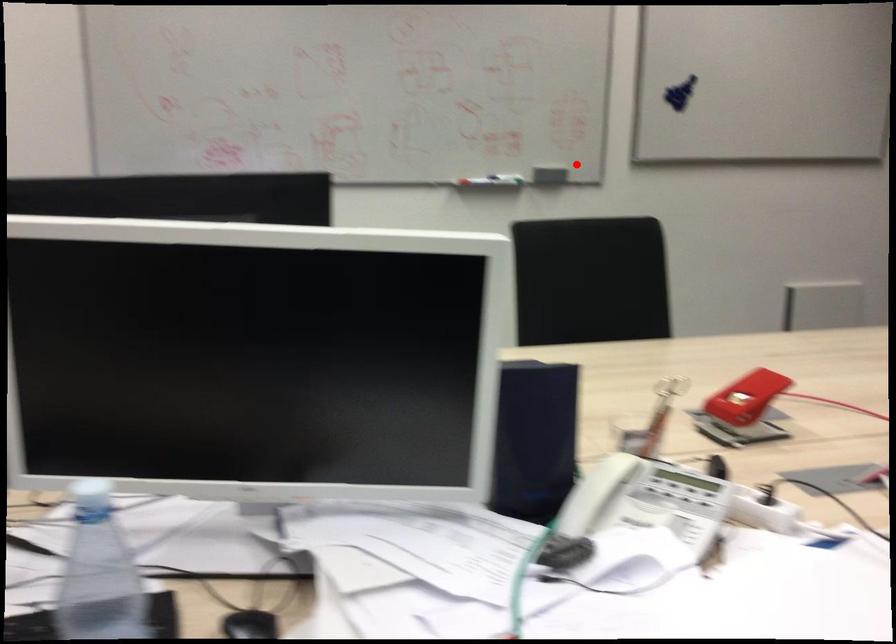
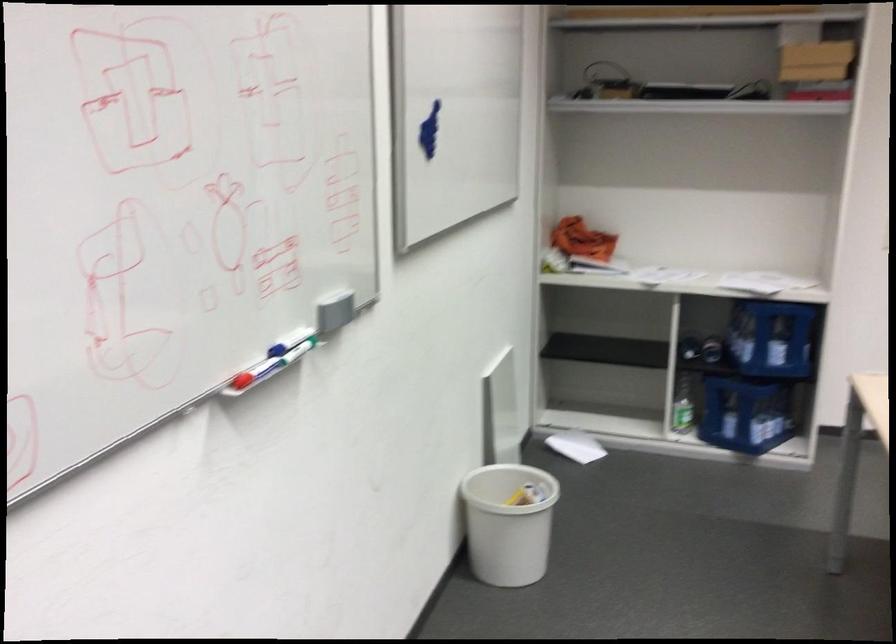
Question: I am providing you with two images of the same scene from different viewpoints. A red point is shown in image1. For the corresponding object point in image2, is it positioned nearer or farther from the camera?

Choices:
 (A) Nearer
 (B) Farther

Answer: (A)